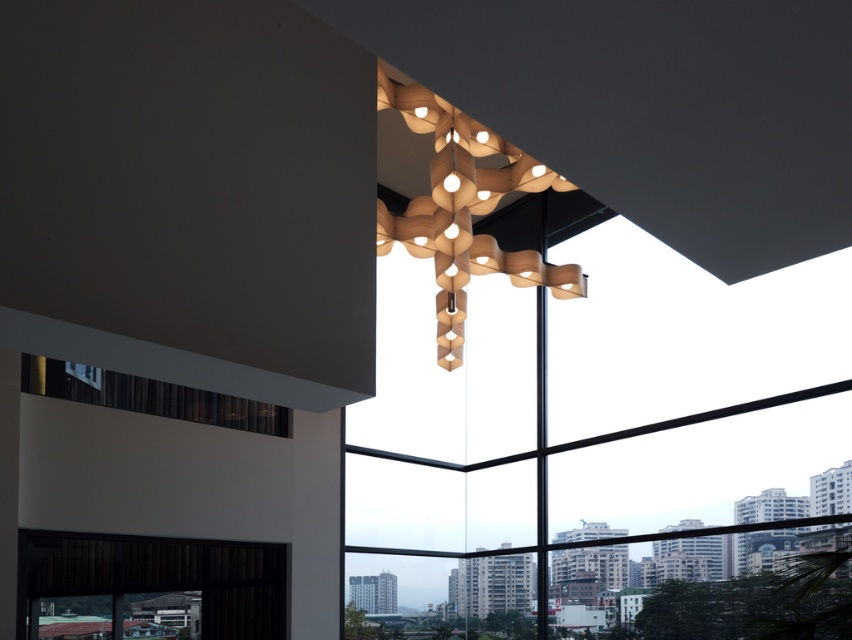
You are an interior designer planning to install a new ceiling fan. You see the wooden chandelier at upper center and the black fabric window at lower left. Which object is directly above the other?

The wooden chandelier at upper center is positioned over the black fabric window at lower left, so the wooden chandelier is directly above the window.

You are an interior designer planning to install a new artwork that is 2.5 meters wide between the wooden chandelier at upper center and the black fabric window at lower left. Will there be enough space for the artwork to fit horizontally between them?

The distance between the wooden chandelier at upper center and the black fabric window at lower left is 3.48 meters. Since the artwork is 2.5 meters wide, there is sufficient space for it to fit horizontally between them.

You are an interior designer planning to install a new ceiling fan that requires a 30 cm diameter space. You see the wooden chandelier at upper center and the black fabric window at lower left. Which object has a larger diameter and can accommodate the ceiling fan?

The wooden chandelier at upper center is larger in size than the black fabric window at lower left, so it can accommodate the ceiling fan if its diameter is at least 30 cm. However, the description only states it is larger in size without specifying exact measurements, so further verification is needed.